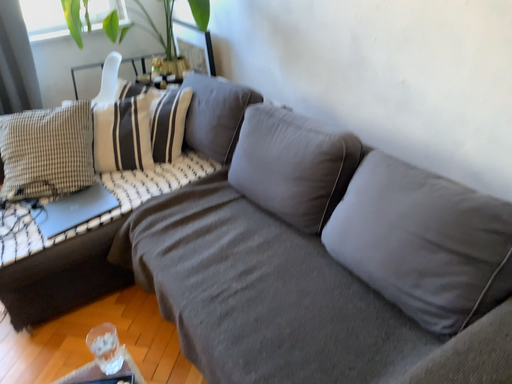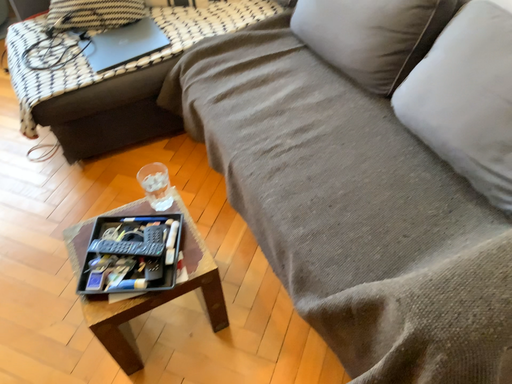
Question: Which way did the camera rotate in the video?

Choices:
 (A) rotated left
 (B) rotated right

Answer: (A)